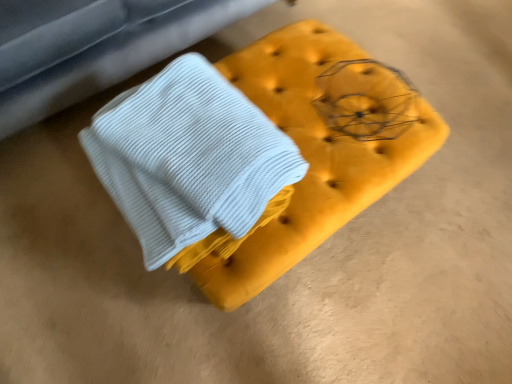
Question: Considering the relative positions of velvet yellow ottoman at center, which is the 1th furniture in bottom-to-top order, and white ribbed fabric at center, positioned as the 1th furniture in top-to-bottom order, in the image provided, is velvet yellow ottoman at center, which is the 1th furniture in bottom-to-top order, to the left or to the right of white ribbed fabric at center, positioned as the 1th furniture in top-to-bottom order,?

Choices:
 (A) left
 (B) right

Answer: (B)

Question: Do you think velvet yellow ottoman at center, which is the 1th furniture in bottom-to-top order, is within white ribbed fabric at center, positioned as the 1th furniture in top-to-bottom order, or outside of it?

Choices:
 (A) outside
 (B) inside

Answer: (A)

Question: Is point pyautogui.click(x=289, y=61) positioned closer to the camera than point pyautogui.click(x=221, y=13)?

Choices:
 (A) farther
 (B) closer

Answer: (B)

Question: Would you say white ribbed fabric at center, which is the second furniture in bottom-to-top order, is to the left or to the right of velvet yellow ottoman at center, which is the 1th furniture in bottom-to-top order, in the picture?

Choices:
 (A) right
 (B) left

Answer: (B)

Question: Based on their sizes in the image, would you say white ribbed fabric at center, which is the second furniture in bottom-to-top order, is bigger or smaller than velvet yellow ottoman at center, the 2th furniture from the top?

Choices:
 (A) small
 (B) big

Answer: (B)

Question: Considering their positions, is white ribbed fabric at center, positioned as the 1th furniture in top-to-bottom order, located in front of or behind velvet yellow ottoman at center, the 2th furniture from the top?

Choices:
 (A) front
 (B) behind

Answer: (B)

Question: From the image's perspective, relative to velvet yellow ottoman at center, which is the 1th furniture in bottom-to-top order, is white ribbed fabric at center, which is the second furniture in bottom-to-top order, above or below?

Choices:
 (A) above
 (B) below

Answer: (A)